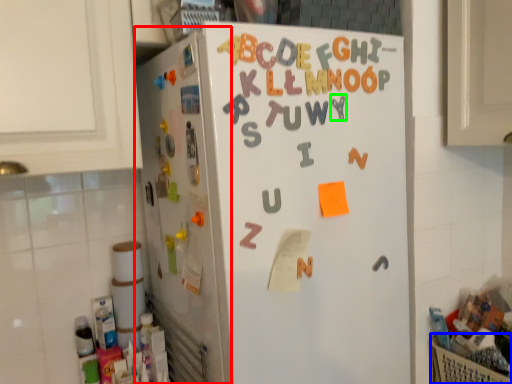
Question: Estimate the real-world distances between objects in this image. Which object is closer to appliance (highlighted by a red box), basket (highlighted by a blue box) or letter (highlighted by a green box)?

Choices:
 (A) basket
 (B) letter

Answer: (B)